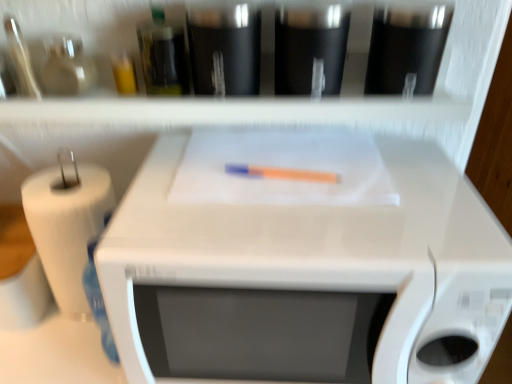
Locate an element on the screen. This screenshot has height=384, width=512. free spot behind orange matte crayon at center is located at coordinates (282, 142).